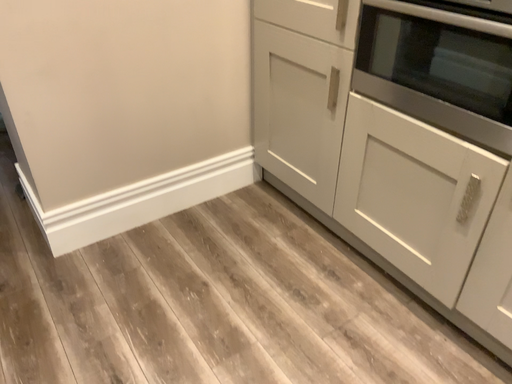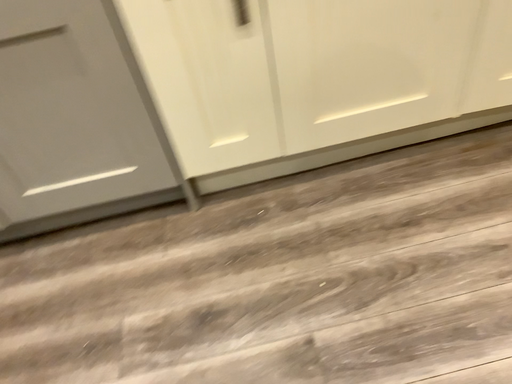
Question: Which way did the camera rotate in the video?

Choices:
 (A) rotated upward
 (B) rotated downward

Answer: (A)